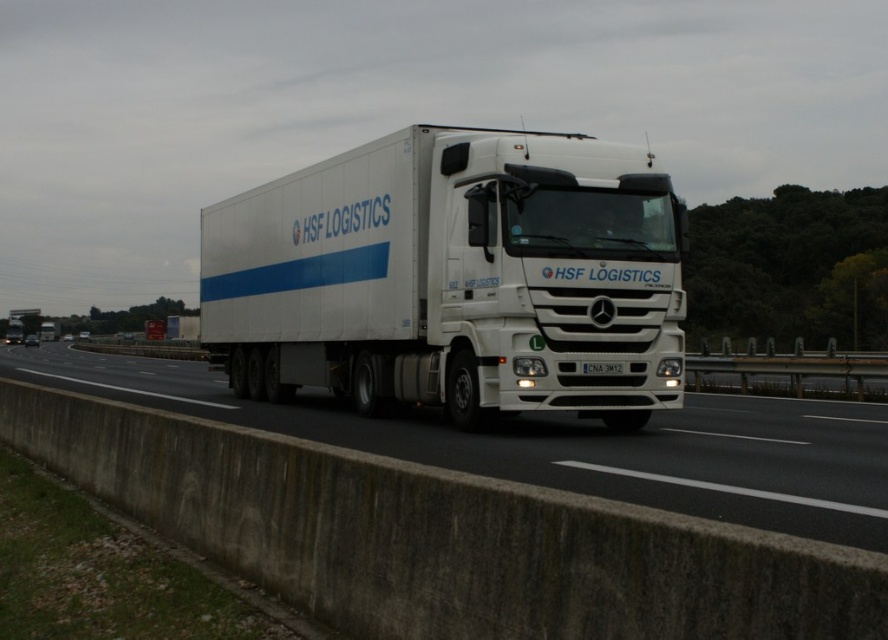
Which is more to the right, white glossy truck at center or white plastic license plate at center?

white plastic license plate at center is more to the right.

Where is `white glossy truck at center`? This screenshot has height=640, width=888. white glossy truck at center is located at coordinates coord(454,276).

You are a GUI agent. You are given a task and a screenshot of the screen. Output one action in this format:
    pyautogui.click(x=<x>, y=<y>)
    Task: Click on the white glossy truck at center
    The image size is (888, 640).
    Given the screenshot: What is the action you would take?
    pyautogui.click(x=454, y=276)

From the picture: Between white glossy truck at center and white concrete barrier at lower center, which one appears on the right side from the viewer's perspective?

Positioned to the right is white glossy truck at center.

Is point (666, 403) in front of point (597, 428)?

Yes, point (666, 403) is closer to viewer.

Locate an element on the screen. white glossy truck at center is located at coordinates (454, 276).

Does white concrete barrier at lower center have a lesser height compared to white plastic license plate at center?

No.

Can you confirm if white concrete barrier at lower center is positioned to the right of white plastic license plate at center?

In fact, white concrete barrier at lower center is to the left of white plastic license plate at center.

Who is more distant from viewer, (703, 426) or (625, 368)?

The point (703, 426) is more distant.

You are a GUI agent. You are given a task and a screenshot of the screen. Output one action in this format:
    pyautogui.click(x=<x>, y=<y>)
    Task: Click on the white concrete barrier at lower center
    
    Given the screenshot: What is the action you would take?
    pyautogui.click(x=567, y=444)